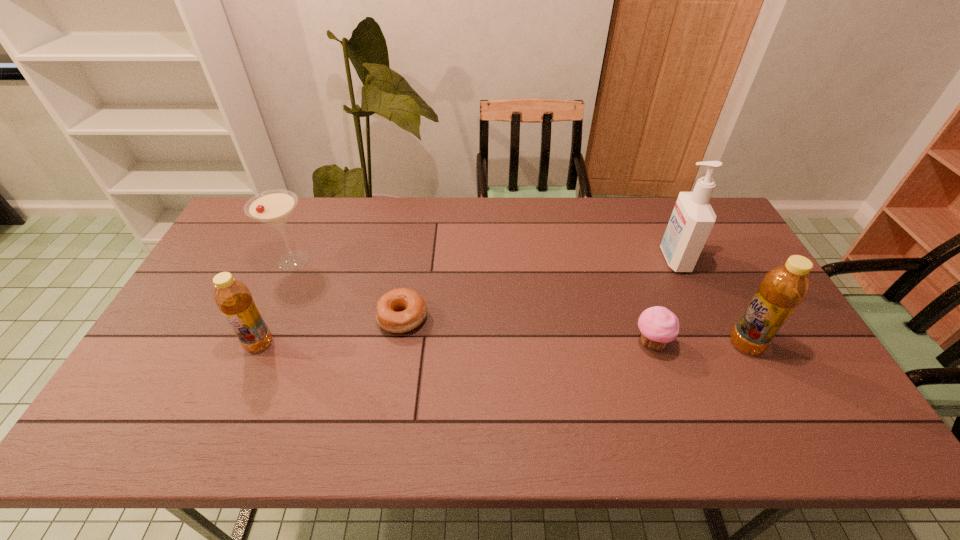
If the aim is uniform spacing by inserting an additional bottle among them, please point to a vacant space for this new bottle. Please provide its 2D coordinates. Your answer should be formatted as a tuple, i.e. [(x, y)], where the tuple contains the x and y coordinates of a point satisfying the conditions above.

[(502, 344)]